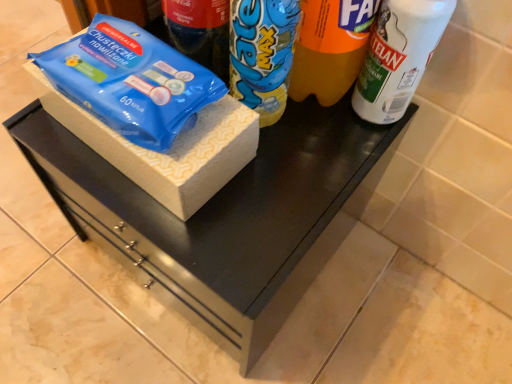
At what (x,y) coordinates should I click in order to perform the action: click on free point in front of blue plastic bottle at center. Please return your answer as a coordinate pair (x, y). This screenshot has height=384, width=512. Looking at the image, I should click on coord(258,211).